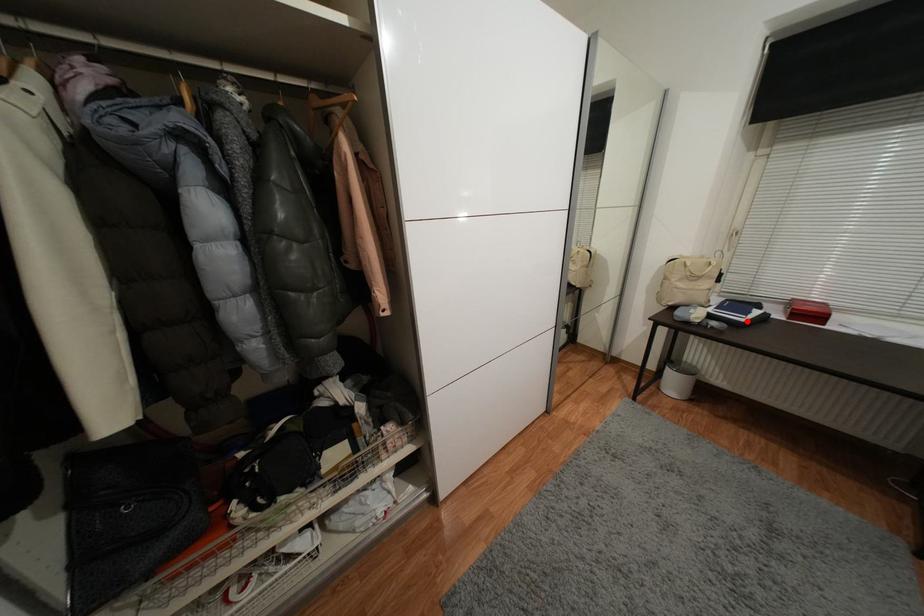
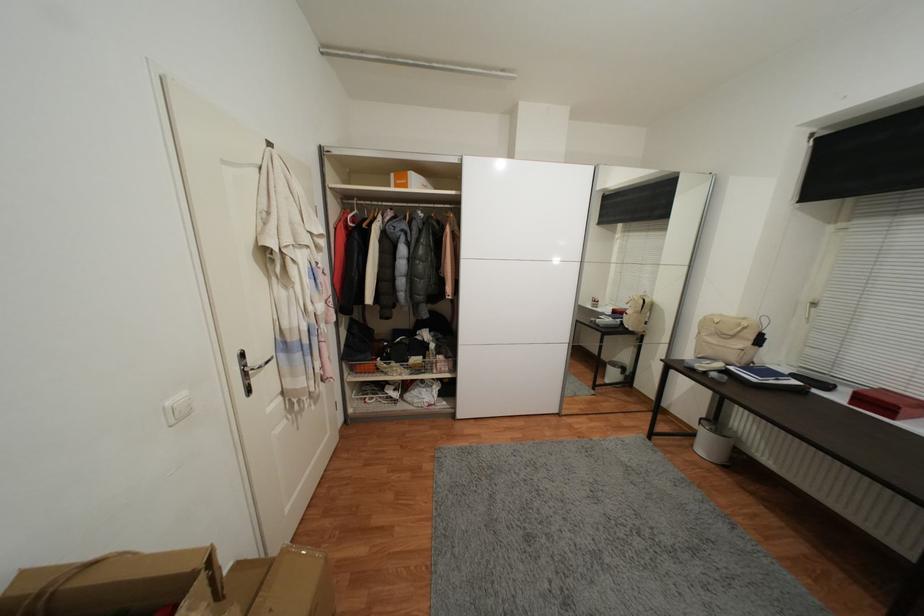
The point at the highlighted location is marked in the first image. Where is the corresponding point in the second image?

(759, 381)